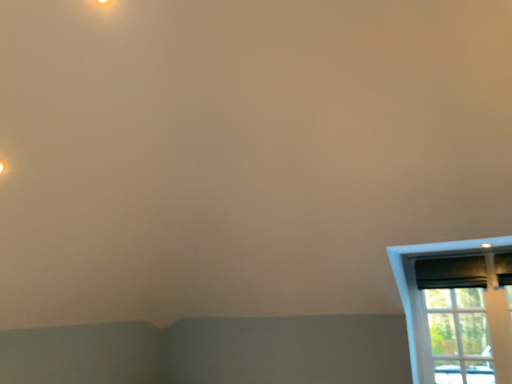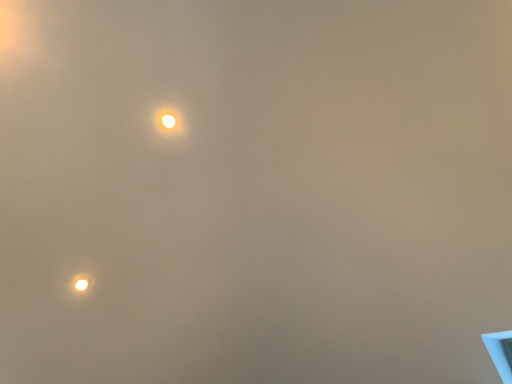
Question: Which way did the camera rotate in the video?

Choices:
 (A) rotated upward
 (B) rotated downward

Answer: (A)